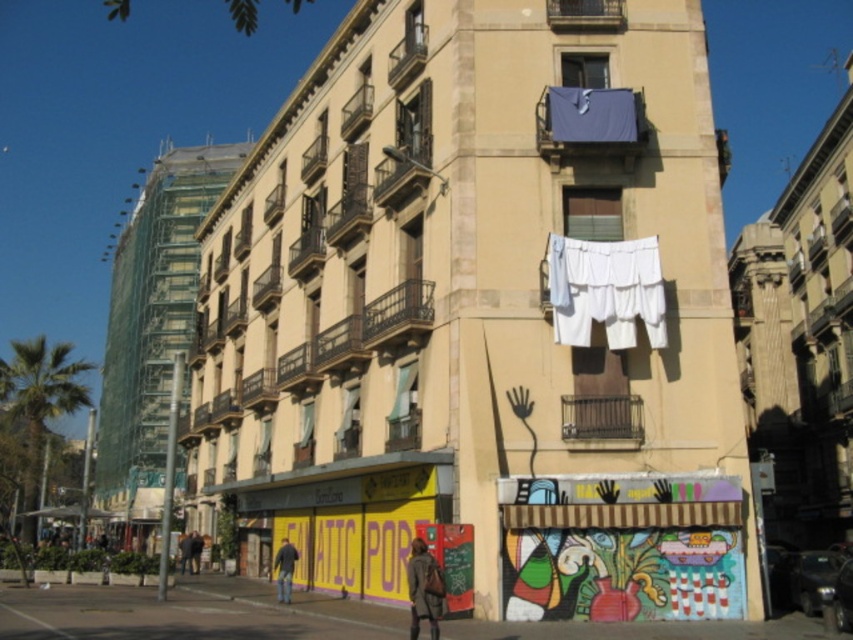
Question: Is white fabric at upper center bigger than denim jeans at lower center?

Choices:
 (A) no
 (B) yes

Answer: (A)

Question: Which object is closer to the camera taking this photo?

Choices:
 (A) white fabric at upper center
 (B) denim jeans at lower center
 (C) dark gray fabric jacket at lower center

Answer: (C)

Question: Which of these objects is positioned closest to the dark gray fabric jacket at lower center?

Choices:
 (A) denim jeans at lower center
 (B) white fabric at upper center

Answer: (A)

Question: Is white fabric at upper center bigger than dark gray fabric jacket at lower center?

Choices:
 (A) no
 (B) yes

Answer: (A)

Question: Does dark gray fabric jacket at lower center appear under denim jeans at lower center?

Choices:
 (A) no
 (B) yes

Answer: (A)

Question: Which of the following is the closest to the observer?

Choices:
 (A) dark gray fabric jacket at lower center
 (B) denim jeans at lower center

Answer: (A)